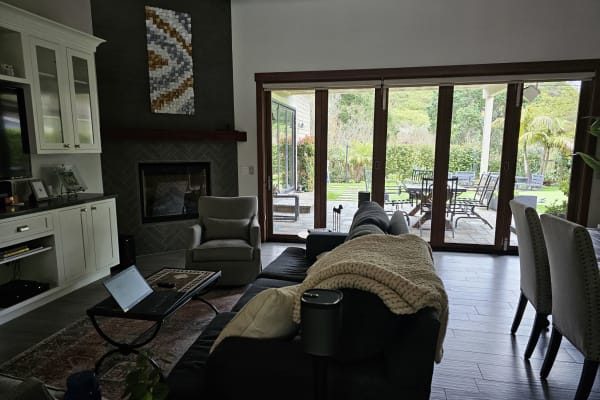
You are a GUI agent. You are given a task and a screenshot of the screen. Output one action in this format:
    pyautogui.click(x=<x>, y=<y>)
    Task: Click on the cabinet
    This screenshot has height=400, width=600.
    Given the screenshot: What is the action you would take?
    pyautogui.click(x=61, y=129), pyautogui.click(x=80, y=127)